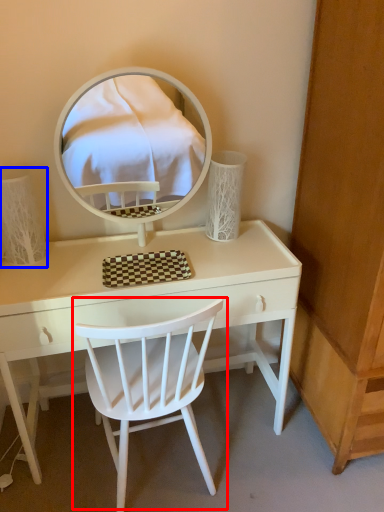
Question: Among these objects, which one is nearest to the camera, chair (highlighted by a red box) or table lamp (highlighted by a blue box)?

Choices:
 (A) chair
 (B) table lamp

Answer: (A)